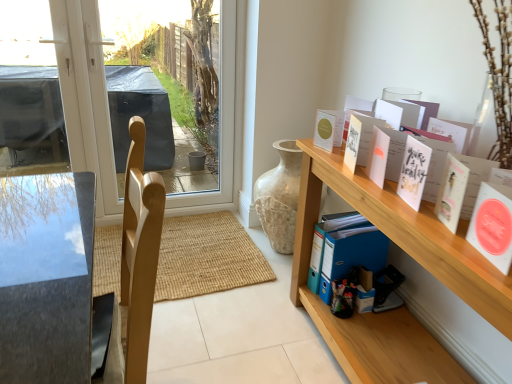
Question: From the image's perspective, is matte white card at upper right, which is the 1th book from back to front, positioned above or below white paper card at upper right, the second book when ordered from back to front?

Choices:
 (A) above
 (B) below

Answer: (A)

Question: In the image, is matte white card at upper right, the fourth book in the front-to-back sequence, on the left side or the right side of white paper card at upper right, arranged as the 3th book when viewed from the front?

Choices:
 (A) right
 (B) left

Answer: (B)

Question: Which is nearer to the matte white card at upper right, the fourth book in the front-to-back sequence?

Choices:
 (A) white matte cards at upper right, which is the first book in front-to-back order
 (B) white paper card at upper right, marked as the 2th book in a front-to-back arrangement
 (C) transparent glass window at upper left
 (D) white paper card at upper right, the second book when ordered from back to front
 (E) wooden shelf at right

Answer: (D)

Question: Which object is positioned farthest from the wooden shelf at right?

Choices:
 (A) matte white card at upper right, the fourth book in the front-to-back sequence
 (B) transparent glass window at upper left
 (C) white paper card at upper right, marked as the 2th book in a front-to-back arrangement
 (D) white paper card at upper right, arranged as the 3th book when viewed from the front
 (E) white matte cards at upper right, positioned as the fourth book in back-to-front order

Answer: (B)